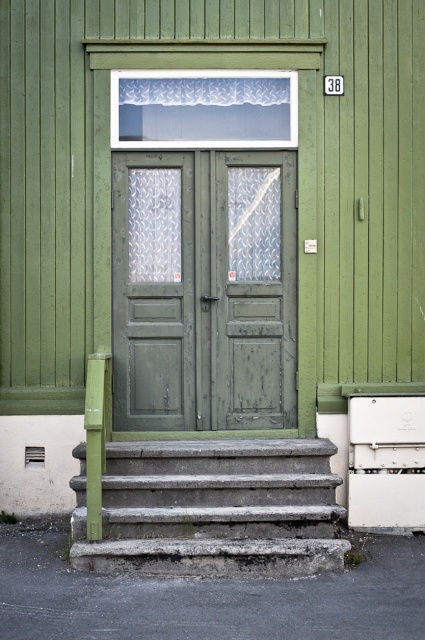
You are standing at the bottom of the concrete steps at lower center looking up at the green wooden door at center. Which object is taller?

The green wooden door at center is taller than the concrete steps at lower center according to the description.

You are standing at the bottom of the concrete steps at lower center and want to enter the building through the green wooden door at center. Which direction should you walk to reach the door?

The green wooden door at center is above the concrete steps at lower center, so you should walk upwards towards the green wooden door at center to reach it.

You are standing at the base of the concrete steps at lower center and want to enter the building through the green wooden door at center. Can you walk straight ahead to reach the door without needing to move sideways?

The green wooden door at center has a lesser width compared to concrete steps at lower center, so yes, you can walk straight ahead to reach the door without needing to move sideways since the door is narrower than the steps.